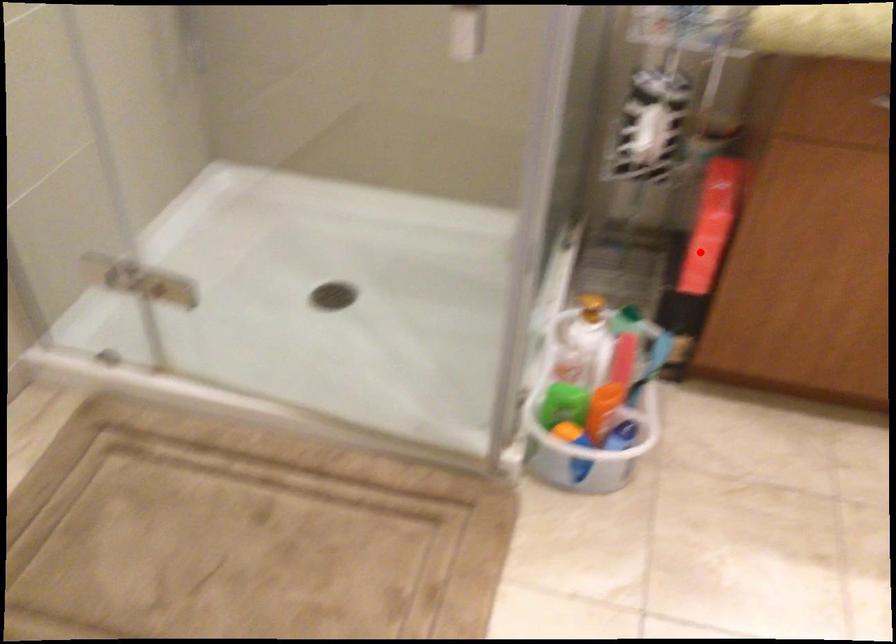
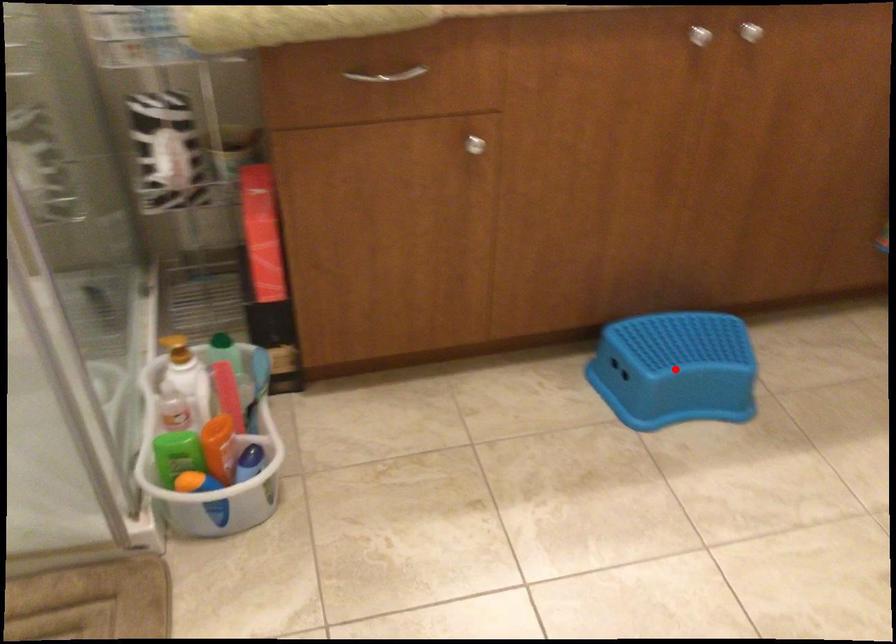
I am providing you with two images of the same scene from different viewpoints. A red point is marked on the first image and another point is marked on the second image. Is the marked point in image1 the same physical position as the marked point in image2?

No